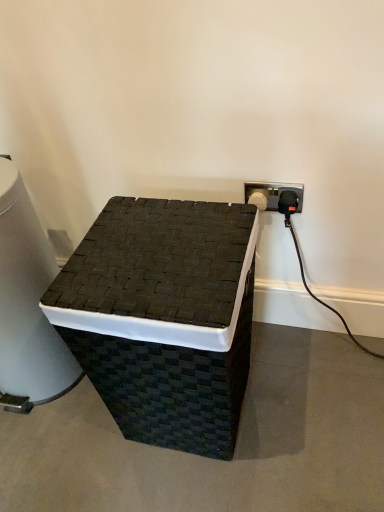
Question: From a real-world perspective, is black woven water cooler at left beneath black woven basket at center?

Choices:
 (A) no
 (B) yes

Answer: (A)

Question: From a real-world perspective, is black woven water cooler at left located higher than black woven basket at center?

Choices:
 (A) yes
 (B) no

Answer: (A)

Question: Can you confirm if black woven water cooler at left is positioned to the right of black woven basket at center?

Choices:
 (A) no
 (B) yes

Answer: (A)

Question: Is black woven water cooler at left facing towards black woven basket at center?

Choices:
 (A) no
 (B) yes

Answer: (A)

Question: Is black woven basket at center completely or partially inside black woven water cooler at left?

Choices:
 (A) yes
 (B) no

Answer: (B)

Question: Is black woven water cooler at left taller than black woven basket at center?

Choices:
 (A) no
 (B) yes

Answer: (B)

Question: Is black woven basket at center bigger than black woven water cooler at left?

Choices:
 (A) no
 (B) yes

Answer: (B)

Question: Is the position of black woven basket at center more distant than that of black woven water cooler at left?

Choices:
 (A) yes
 (B) no

Answer: (B)

Question: Considering the relative positions of black woven basket at center and black woven water cooler at left in the image provided, is black woven basket at center to the left of black woven water cooler at left from the viewer's perspective?

Choices:
 (A) yes
 (B) no

Answer: (B)

Question: Does black woven basket at center touch black woven water cooler at left?

Choices:
 (A) yes
 (B) no

Answer: (B)

Question: From a real-world perspective, is black woven basket at center located higher than black woven water cooler at left?

Choices:
 (A) yes
 (B) no

Answer: (B)

Question: From the image's perspective, is black woven basket at center over black woven water cooler at left?

Choices:
 (A) no
 (B) yes

Answer: (A)

Question: From a real-world perspective, is black woven basket at center physically located above or below black woven water cooler at left?

Choices:
 (A) below
 (B) above

Answer: (A)